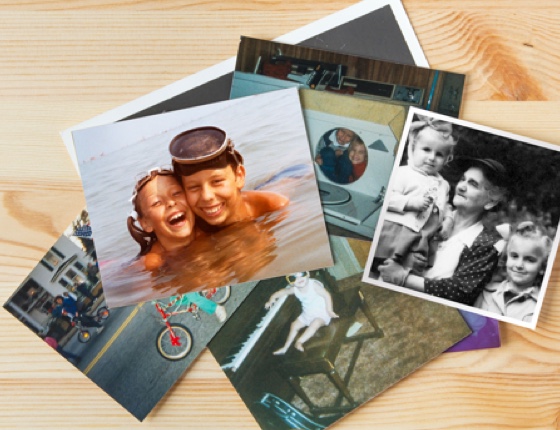
Where is `photos`? The image size is (560, 430). photos is located at coordinates (515, 272), (357, 134), (364, 27), (200, 157), (338, 360), (488, 338), (136, 367).